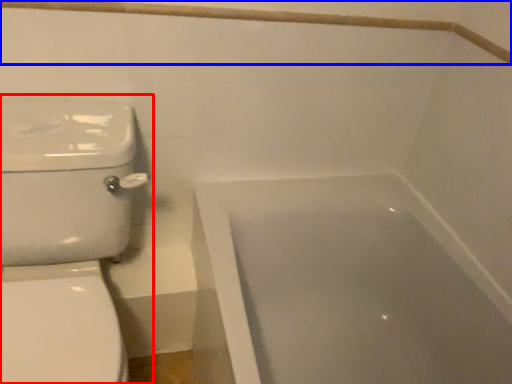
Question: Among these objects, which one is nearest to the camera, toilet (highlighted by a red box) or balustrade (highlighted by a blue box)?

Choices:
 (A) toilet
 (B) balustrade

Answer: (A)